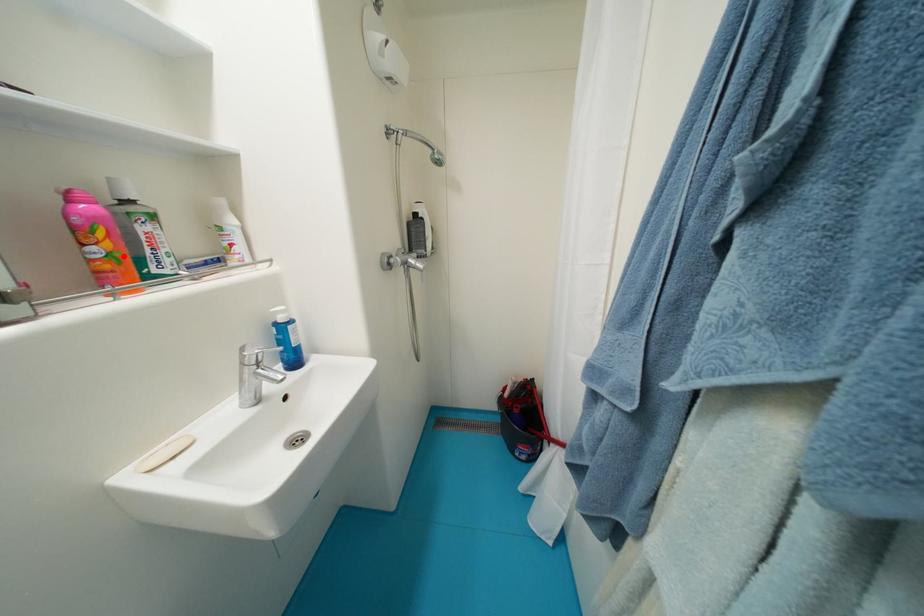
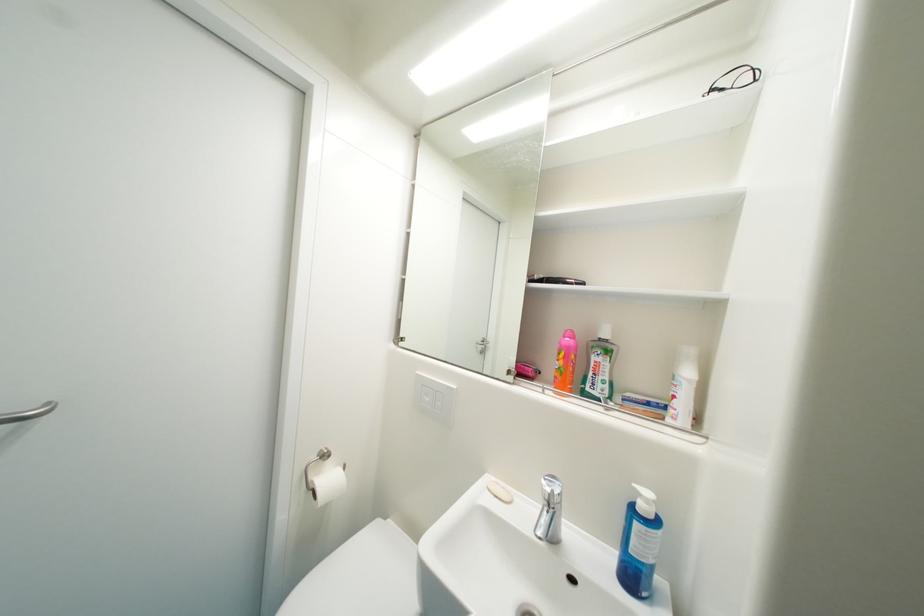
Locate, in the second image, the point that corresponds to the highlighted location in the first image.

(569, 371)